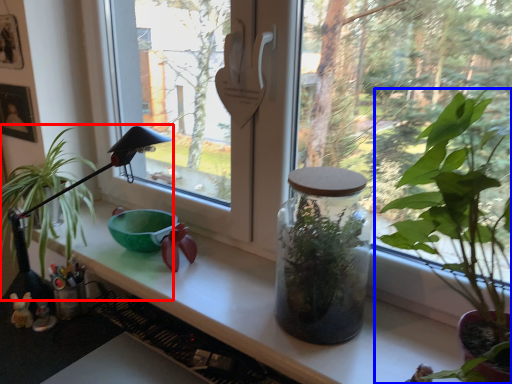
Question: Which object is closer to the camera taking this photo, houseplant (highlighted by a red box) or houseplant (highlighted by a blue box)?

Choices:
 (A) houseplant
 (B) houseplant

Answer: (B)